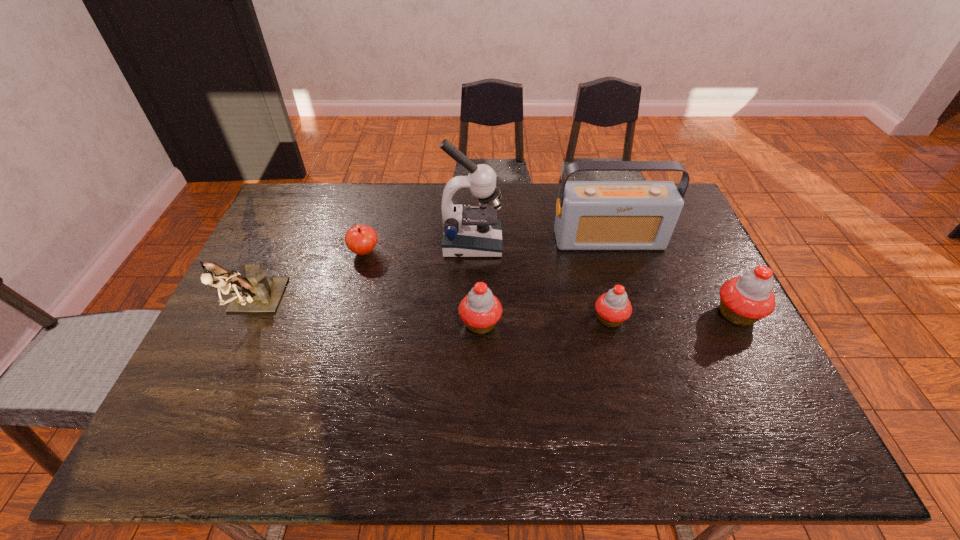
You are a GUI agent. You are given a task and a screenshot of the screen. Output one action in this format:
    pyautogui.click(x=<x>, y=<y>)
    Task: Click on the vacant region located 0.370m on the back of the second shortest cupcake
    
    Given the screenshot: What is the action you would take?
    pyautogui.click(x=480, y=223)

Identify the location of free space located on the left of the shortest cupcake. This screenshot has height=540, width=960. (452, 319).

Where is `vacant space situated on the front of the rightmost cupcake`? vacant space situated on the front of the rightmost cupcake is located at coordinates (756, 353).

You are a GUI agent. You are given a task and a screenshot of the screen. Output one action in this format:
    pyautogui.click(x=<x>, y=<y>)
    Task: Click on the blank space located 0.130m on the right of the apple
    This screenshot has width=960, height=540.
    Given the screenshot: What is the action you would take?
    pyautogui.click(x=421, y=252)

The width and height of the screenshot is (960, 540). I want to click on blank space located at the eyepiece of the microscope, so (x=570, y=244).

Where is `vacant area situated on the front-facing side of the radio receiver`? This screenshot has height=540, width=960. vacant area situated on the front-facing side of the radio receiver is located at coordinates (628, 302).

Find the location of a particular element. This screenshot has height=540, width=960. free space located on the front-facing side of the figurine is located at coordinates (206, 408).

Locate an element on the screen. object located at the left edge is located at coordinates (253, 291).

Where is `cupcake at the right edge`? This screenshot has height=540, width=960. cupcake at the right edge is located at coordinates (744, 300).

This screenshot has height=540, width=960. What are the coordinates of `radio receiver present at the right edge` in the screenshot? It's located at (590, 215).